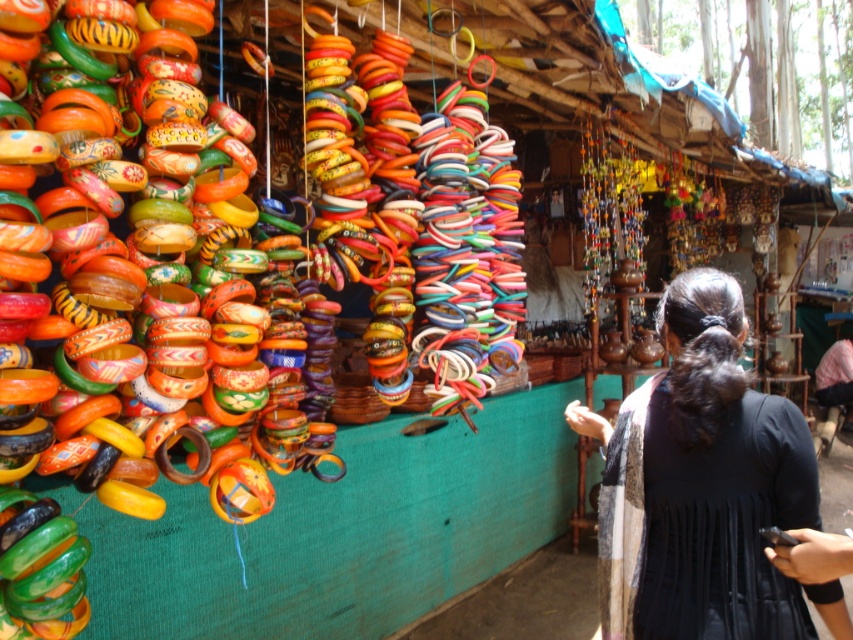
Is point (630, 586) farther from camera compared to point (821, 600)?

Yes, point (630, 586) is farther from viewer.

Describe the element at coordinates (701, 484) in the screenshot. This screenshot has height=640, width=853. I see `black fabric at center` at that location.

The image size is (853, 640). I want to click on black fabric at center, so click(701, 484).